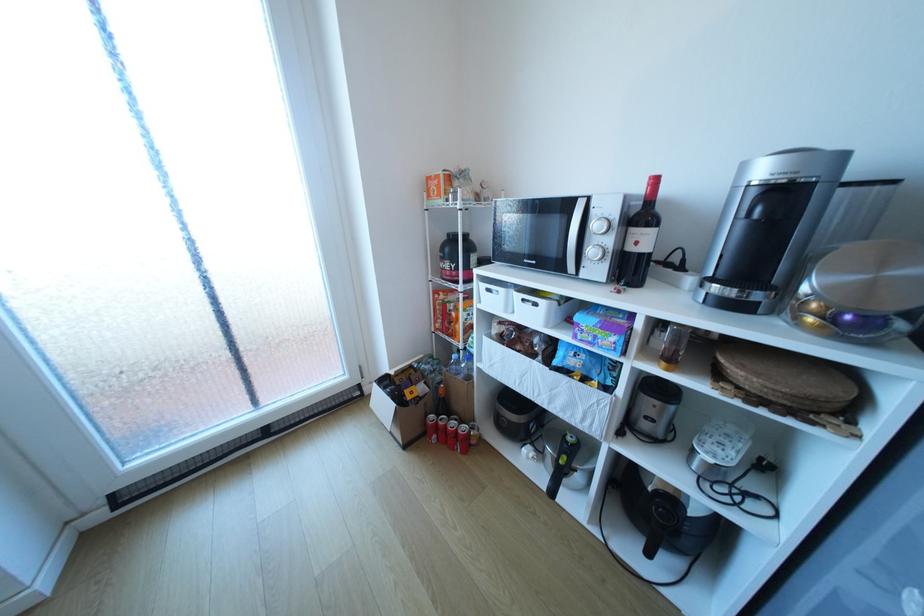
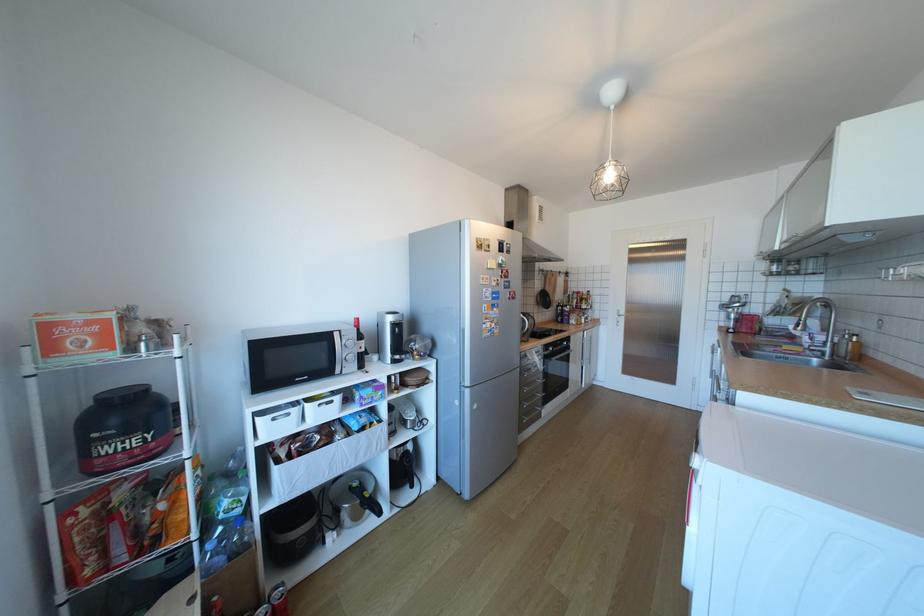
The point at (459, 265) is marked in the first image. Where is the corresponding point in the second image?

(152, 439)